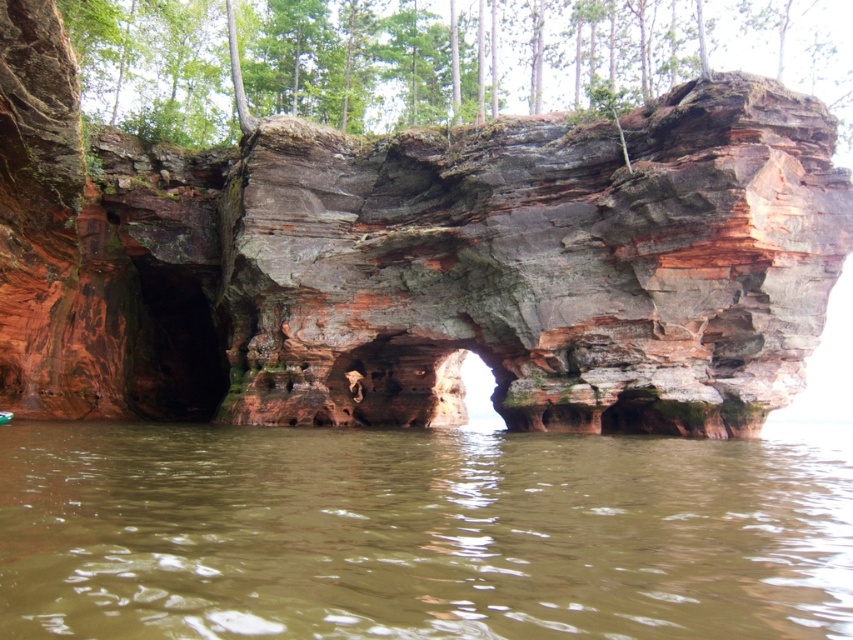
Question: Among these objects, which one is farthest from the camera?

Choices:
 (A) rustic stone arch at center
 (B) brown murky water at lower center

Answer: (A)

Question: Can you confirm if rustic stone arch at center is thinner than brown murky water at lower center?

Choices:
 (A) yes
 (B) no

Answer: (B)

Question: From the image, what is the correct spatial relationship of rustic stone arch at center in relation to brown murky water at lower center?

Choices:
 (A) above
 (B) below

Answer: (A)

Question: Which point appears farthest from the camera in this image?

Choices:
 (A) (331, 540)
 (B) (706, 182)

Answer: (B)

Question: Is rustic stone arch at center bigger than brown murky water at lower center?

Choices:
 (A) no
 (B) yes

Answer: (B)